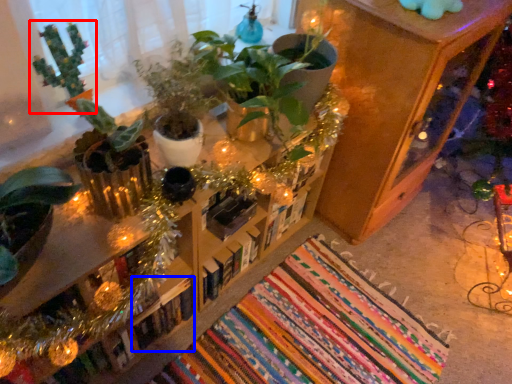
Question: Which object is closer to the camera taking this photo, houseplant (highlighted by a red box) or book (highlighted by a blue box)?

Choices:
 (A) houseplant
 (B) book

Answer: (A)